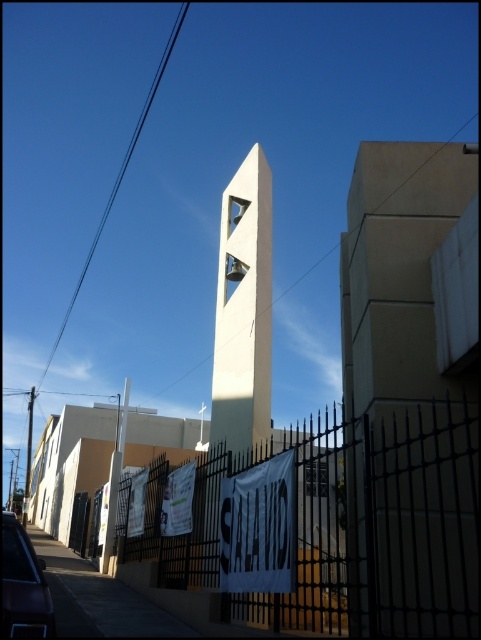
Who is taller, black wrought iron fence at lower center or white smooth bell tower at center?

With more height is white smooth bell tower at center.

Does black wrought iron fence at lower center appear under white smooth bell tower at center?

Yes.

Does point (175, 544) come farther from viewer compared to point (244, 336)?

No, (175, 544) is in front of (244, 336).

Where is `black wrought iron fence at lower center`? The height and width of the screenshot is (640, 481). black wrought iron fence at lower center is located at coordinates (381, 528).

Does black wrought iron fence at lower center appear under black wire at upper left?

Correct, black wrought iron fence at lower center is located below black wire at upper left.

Who is taller, black wrought iron fence at lower center or black wire at upper left?

black wire at upper left is taller.

Image resolution: width=481 pixels, height=640 pixels. What do you see at coordinates (381, 528) in the screenshot?
I see `black wrought iron fence at lower center` at bounding box center [381, 528].

Find the location of a particular element. black wrought iron fence at lower center is located at coordinates pyautogui.click(x=381, y=528).

Between white smooth bell tower at center and black wire at upper left, which one appears on the left side from the viewer's perspective?

black wire at upper left is more to the left.

Does point (230, 412) come in front of point (79, 280)?

Yes, it is.

Find the location of a particular element. white smooth bell tower at center is located at coordinates (243, 308).